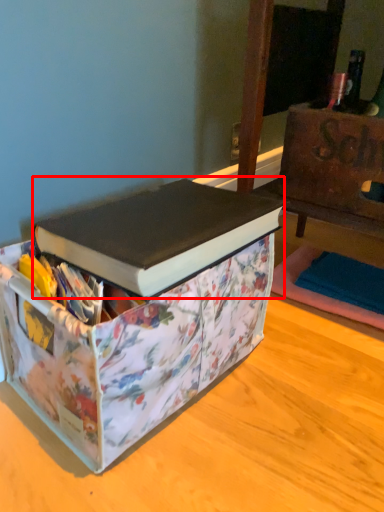
Question: From the image, what is the correct spatial relationship of book (annotated by the red box) in relation to box?

Choices:
 (A) left
 (B) right

Answer: (B)